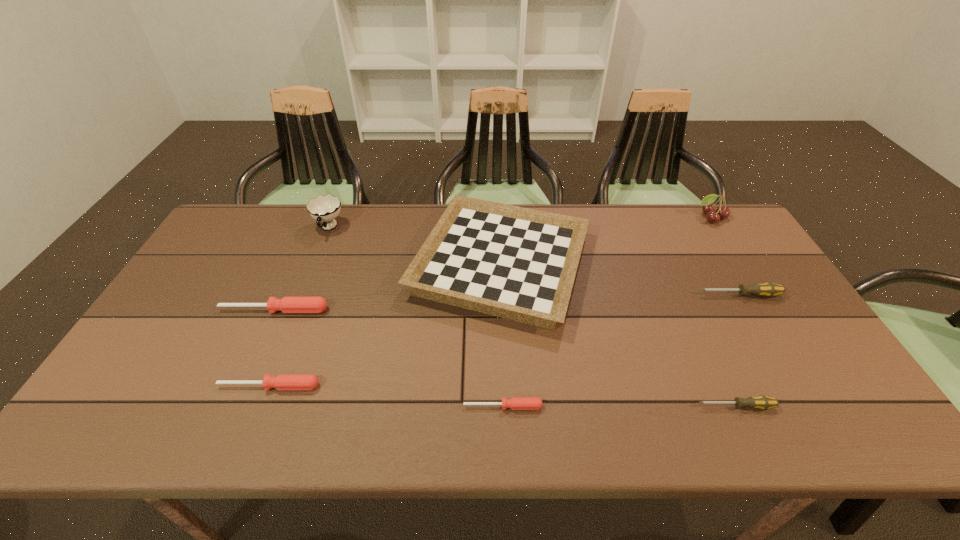
At what (x,y) coordinates should I click in order to perform the action: click on blank area located 0.400m at the tip of the nearer gray screwdriver. Please return your answer as a coordinate pair (x, y). This screenshot has height=540, width=960. Looking at the image, I should click on (522, 406).

The image size is (960, 540). Find the location of `vacant space located 0.310m at the tip of the nearer gray screwdriver`. vacant space located 0.310m at the tip of the nearer gray screwdriver is located at coordinates (562, 406).

Where is `vacant space located at the tip of the nearer gray screwdriver`? Image resolution: width=960 pixels, height=540 pixels. vacant space located at the tip of the nearer gray screwdriver is located at coordinates (610, 406).

You are a GUI agent. You are given a task and a screenshot of the screen. Output one action in this format:
    pyautogui.click(x=<x>, y=<y>)
    Task: Click on the vacant space located on the back of the shortest screwdriver
    This screenshot has height=540, width=960.
    Given the screenshot: What is the action you would take?
    pyautogui.click(x=501, y=369)

Find the location of a particular element. The image size is (960, 540). cherry that is positioned at the far edge is located at coordinates (708, 208).

Identify the location of cup that is at the far edge. (324, 208).

The width and height of the screenshot is (960, 540). I want to click on checkerboard that is positioned at the far edge, so click(x=512, y=262).

At what (x,y) coordinates should I click in order to perform the action: click on object at the left edge. Please return your answer as a coordinate pair (x, y). The height and width of the screenshot is (540, 960). Looking at the image, I should click on (287, 304).

At what (x,y) coordinates should I click in order to perform the action: click on cherry located at the right edge. Please return your answer as a coordinate pair (x, y). The width and height of the screenshot is (960, 540). Looking at the image, I should click on (708, 208).

The height and width of the screenshot is (540, 960). Find the location of `screwdriver that is at the right edge`. screwdriver that is at the right edge is located at coordinates (768, 289).